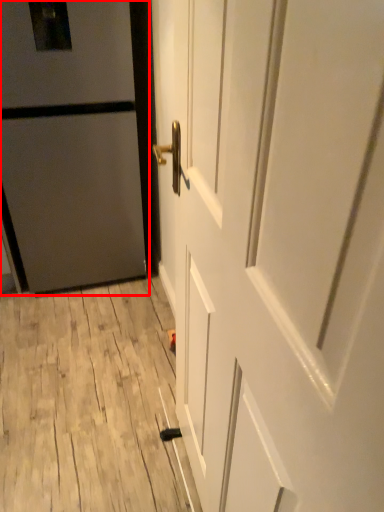
Question: Observing the image, what is the correct spatial positioning of door (annotated by the red box) in reference to door?

Choices:
 (A) left
 (B) right

Answer: (A)